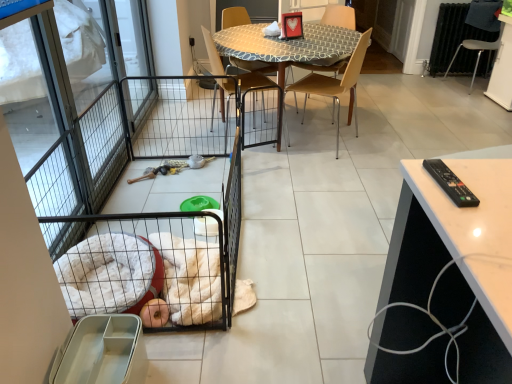
What are the coordinates of `free spot below black wire pet cage at left (from a real-world perspective)` in the screenshot? It's located at (178, 206).